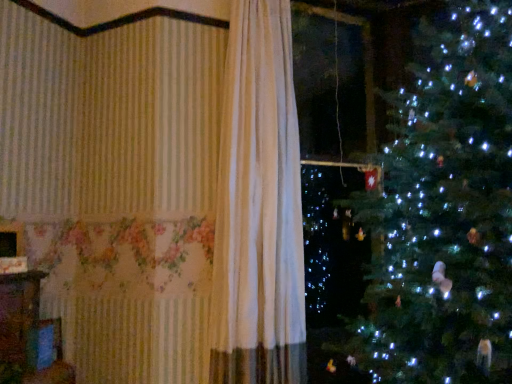
Describe the element at coordinates (258, 207) in the screenshot. I see `white silky curtain at center` at that location.

In order to face white silky curtain at center, should I rotate leftwards or rightwards?

Turn right by 0.898 degrees to look at white silky curtain at center.

This screenshot has height=384, width=512. Identify the location of white silky curtain at center. (258, 207).

Locate an element on the screen. This screenshot has width=512, height=384. white silky curtain at center is located at coordinates (258, 207).